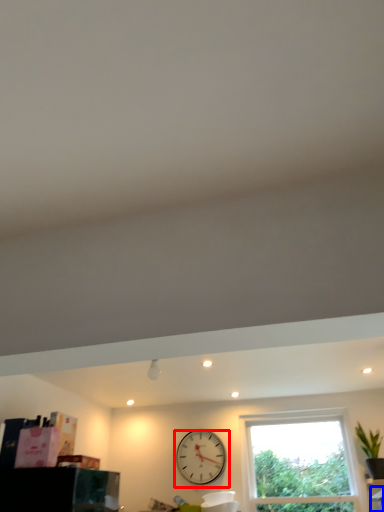
Question: Among these objects, which one is nearest to the camera, wall clock (highlighted by a red box) or furniture (highlighted by a blue box)?

Choices:
 (A) wall clock
 (B) furniture

Answer: (B)